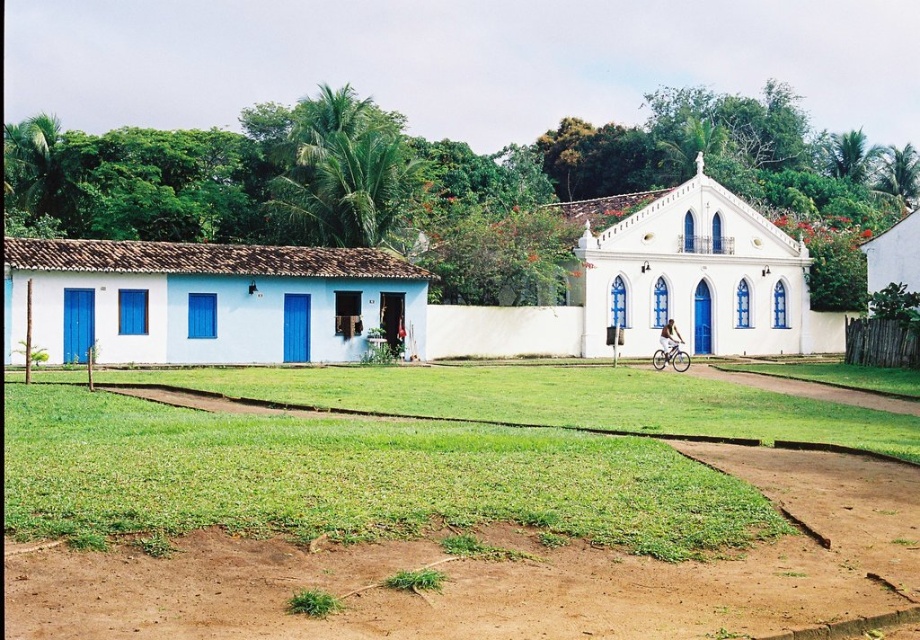
Question: Is green grass at center below white smooth chapel at center?

Choices:
 (A) no
 (B) yes

Answer: (B)

Question: Is brown dirt track at lower center to the right of white matte/blue doors at left from the viewer's perspective?

Choices:
 (A) no
 (B) yes

Answer: (B)

Question: Which object is the farthest from the green grass at center?

Choices:
 (A) white matte/blue doors at left
 (B) brown dirt track at lower center
 (C) white smooth chapel at center
 (D) white metallic bicycle at center

Answer: (B)

Question: Which object appears farthest from the camera in this image?

Choices:
 (A) white matte/blue doors at left
 (B) white smooth chapel at center
 (C) white metallic bicycle at center

Answer: (B)

Question: Which of these objects is positioned farthest from the brown dirt track at lower center?

Choices:
 (A) white metallic bicycle at center
 (B) white smooth chapel at center

Answer: (B)

Question: Does white matte/blue doors at left appear on the right side of white smooth chapel at center?

Choices:
 (A) yes
 (B) no

Answer: (B)